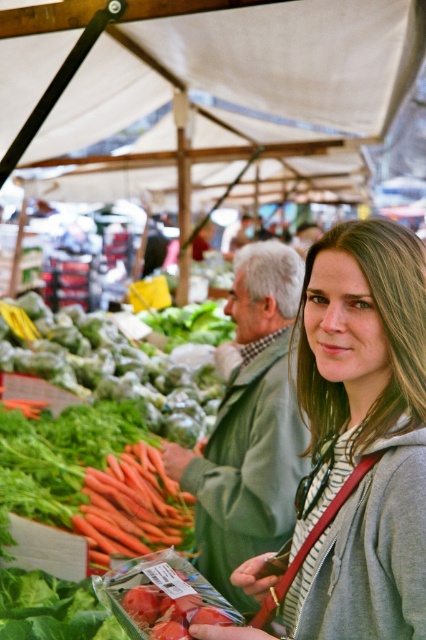
You are a shopper at the farmer market and you want to pick up the orange carrot at center and the orange smooth carrot at center. Which one is on the left side?

The orange carrot at center is on the left side of the orange smooth carrot at center.

You are standing at the farmer market and see two points in the scene. The first point is at coordinate point [267,115] and the second point is at coordinate point [118,509]. Which point is closer to you?

Point [267,115] is closer to you because it is further to the viewer than point [118,509].

From the picture: You are a photographer setting up a tripod to capture the farmer market scene. You notice the white fabric canopy at upper center and the orange smooth carrot at center. Which object is closer to the camera?

The orange smooth carrot at center is closer to the camera than the white fabric canopy at upper center because the orange smooth carrot at center is taller than the white fabric canopy at upper center.